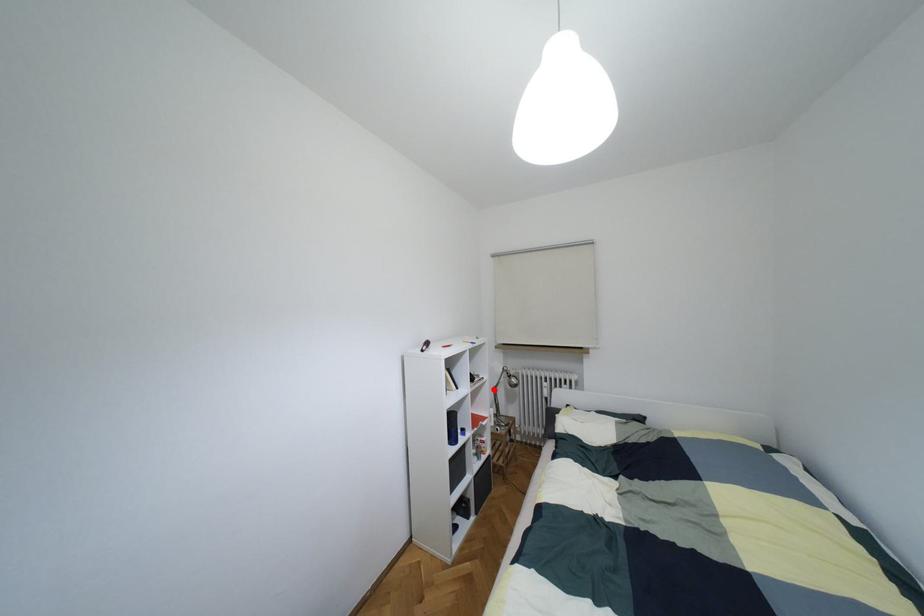
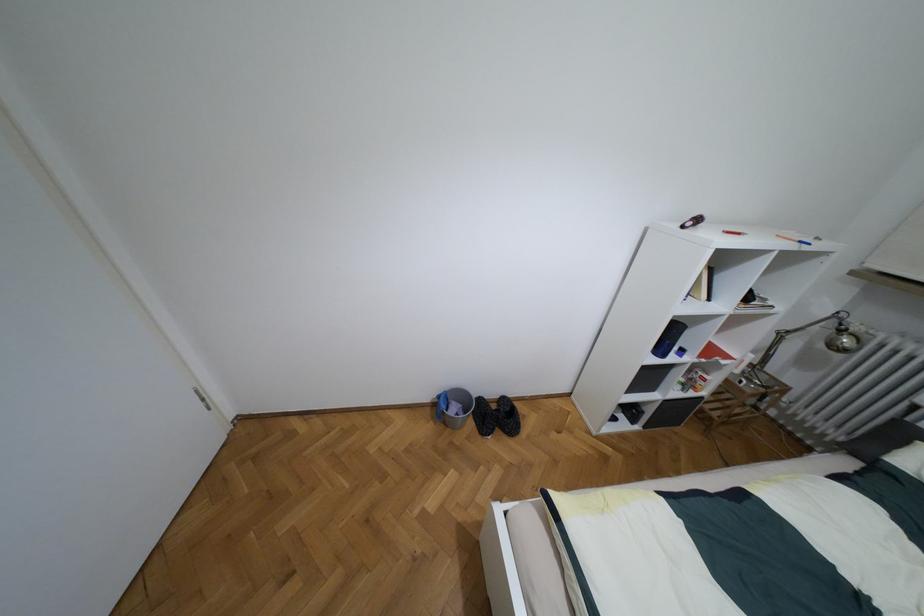
Question: I am providing you with two images of the same scene from different viewpoints. Image1 has a red point marked. In image2, the corresponding 3D location appears at what relative position? Reply with the corresponding letter.

Choices:
 (A) Closer
 (B) Farther

Answer: (A)